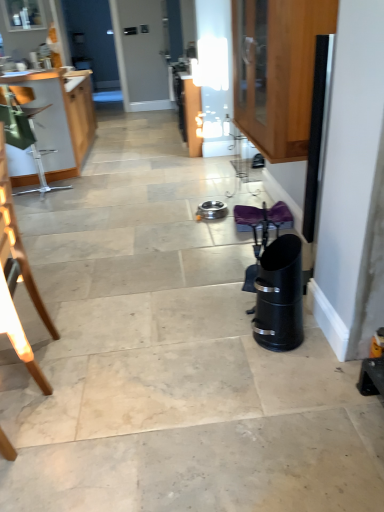
Question: Visually, is wooden chair at left positioned to the left or to the right of wooden cabinet at left, which is the 1th cabinetry from back to front?

Choices:
 (A) right
 (B) left

Answer: (A)

Question: In terms of width, does wooden chair at left look wider or thinner when compared to wooden cabinet at left, acting as the 2th cabinetry starting from the front?

Choices:
 (A) thin
 (B) wide

Answer: (A)

Question: Which object is positioned closest to the wooden chair at left?

Choices:
 (A) wooden cabinet at left, which is the first cabinetry in left-to-right order
 (B) wooden cabinet at upper right, which ranks as the 2th cabinetry in left-to-right order

Answer: (B)

Question: Estimate the real-world distances between objects in this image. Which object is farther from the wooden cabinet at left, which is the 1th cabinetry from back to front?

Choices:
 (A) wooden cabinet at upper right, placed as the 2th cabinetry when sorted from back to front
 (B) wooden chair at left

Answer: (B)